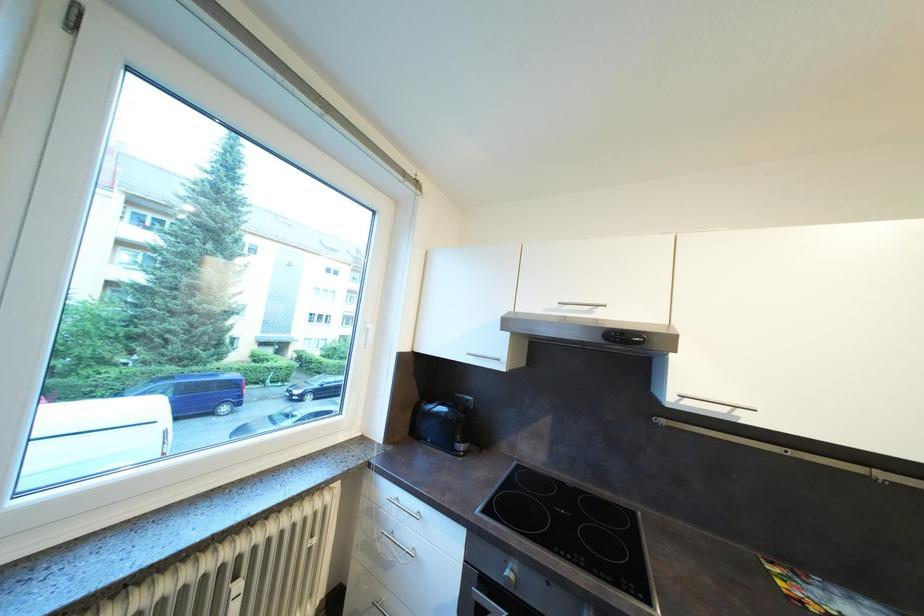
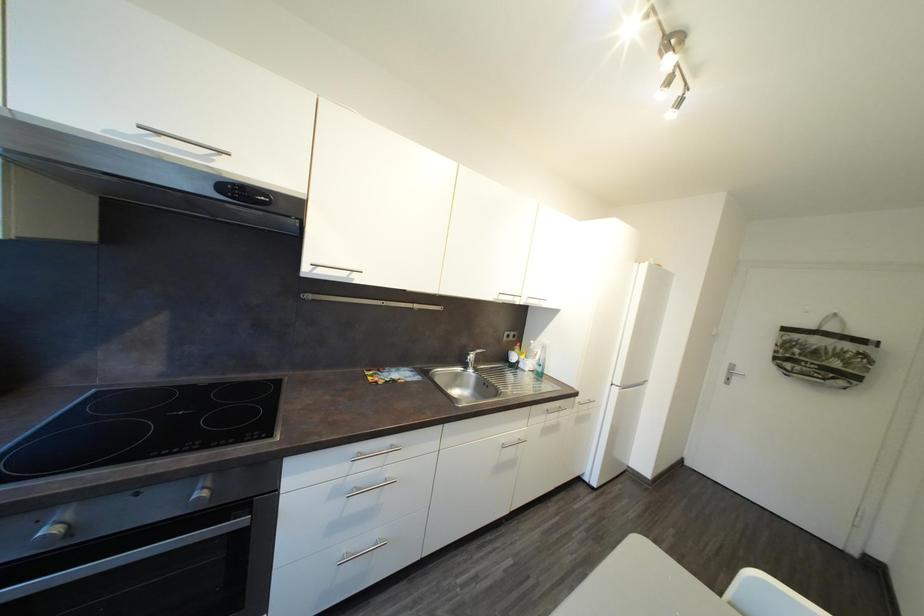
Question: The images are taken continuously from a first-person perspective. In which direction is your viewpoint rotating?

Choices:
 (A) Left
 (B) Right
 (C) Up
 (D) Down

Answer: (B)